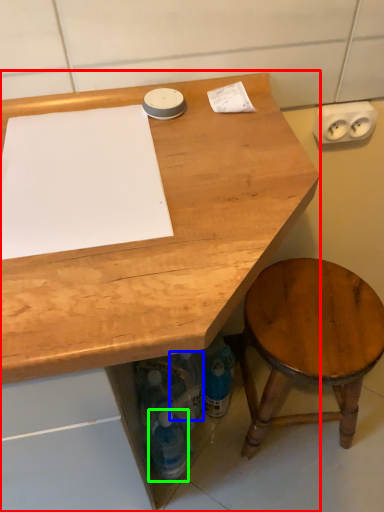
Question: Which object is the farthest from desk (highlighted by a red box)? Choose among these: bottle (highlighted by a blue box) or bottle (highlighted by a green box).

Choices:
 (A) bottle
 (B) bottle

Answer: (A)